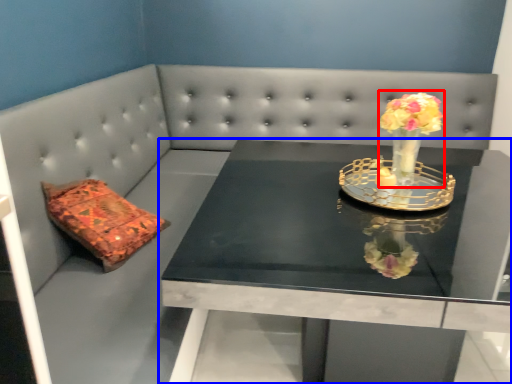
Question: Which object appears closest to the camera in this image, floral arrangement (highlighted by a red box) or table (highlighted by a blue box)?

Choices:
 (A) floral arrangement
 (B) table

Answer: (B)